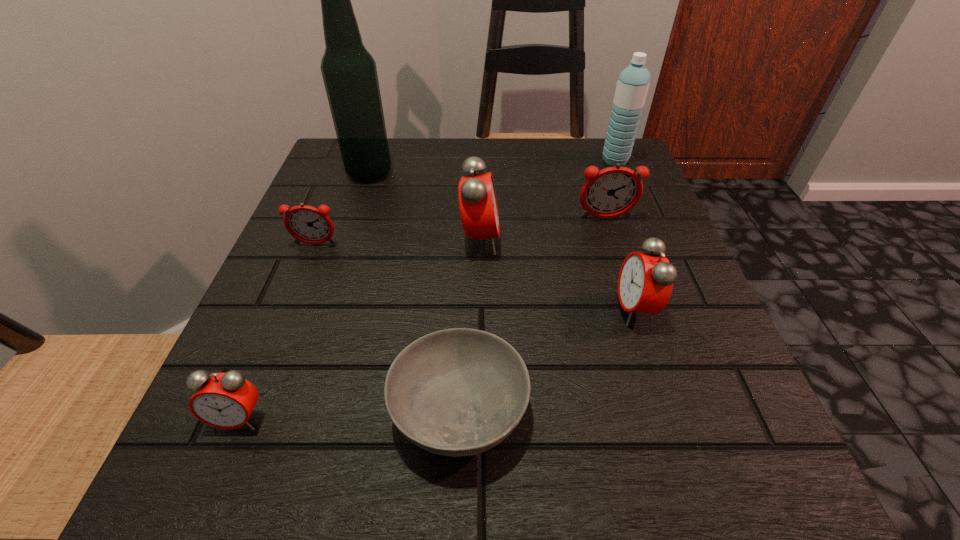
Where is `the smaller reddish-pink alarm clock`? This screenshot has height=540, width=960. the smaller reddish-pink alarm clock is located at coordinates click(x=307, y=224).

The height and width of the screenshot is (540, 960). I want to click on the left reddish-pink alarm clock, so click(307, 224).

You are a GUI agent. You are given a task and a screenshot of the screen. Output one action in this format:
    pyautogui.click(x=<x>, y=<y>)
    Task: Click on the smallest red alarm clock
    
    Given the screenshot: What is the action you would take?
    pyautogui.click(x=226, y=400)

This screenshot has height=540, width=960. I want to click on the leftmost red alarm clock, so coord(226,400).

At what (x,y) coordinates should I click in order to perform the action: click on the shortest object. Please return your answer as a coordinate pair (x, y). This screenshot has height=540, width=960. Looking at the image, I should click on (455, 392).

The image size is (960, 540). I want to click on blank space located on the front of the green alcohol, so click(350, 230).

The width and height of the screenshot is (960, 540). I want to click on free spot located on the front of the second tallest object, so click(x=629, y=192).

In order to click on vacant area situated 0.260m on the front-facing side of the second red alarm clock from left to right in this screenshot , I will do `click(640, 240)`.

Image resolution: width=960 pixels, height=540 pixels. I want to click on vacant space located 0.110m on the front-facing side of the farther reddish-pink alarm clock, so click(619, 262).

Locate an element on the screen. vacant space situated 0.310m on the front-facing side of the third nearest object is located at coordinates (420, 309).